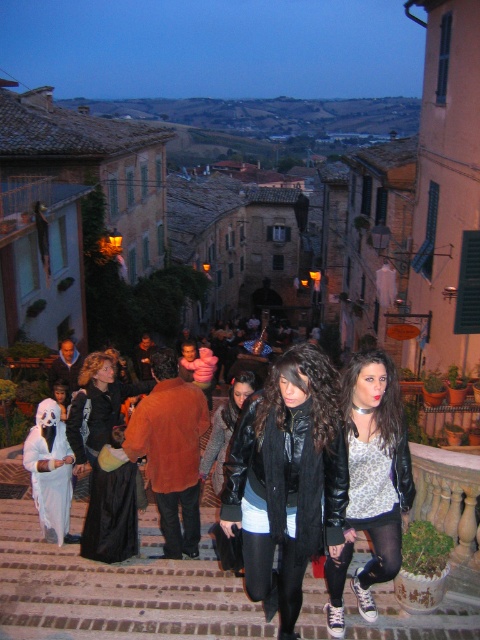
Question: Does black velvet dress at center appear over black leather jacket at center?

Choices:
 (A) no
 (B) yes

Answer: (A)

Question: Is brown brick stairs at center positioned behind matte black jacket at center?

Choices:
 (A) yes
 (B) no

Answer: (A)

Question: Where is brown brick stairs at center located in relation to white matte ghost at left in the image?

Choices:
 (A) above
 (B) below

Answer: (B)

Question: Which object appears closest to the camera in this image?

Choices:
 (A) black leather jacket at center
 (B) leather jacket at center
 (C) white matte ghost at left
 (D) matte black jacket at center

Answer: (D)

Question: Among these points, which one is nearest to the camera?

Choices:
 (A) (6, 541)
 (B) (100, 397)
 (C) (359, 433)
 (D) (60, 481)

Answer: (C)

Question: Which object appears closest to the camera in this image?

Choices:
 (A) white matte ghost at left
 (B) leather jacket at center
 (C) matte black jacket at center
 (D) brown brick stairs at center

Answer: (C)